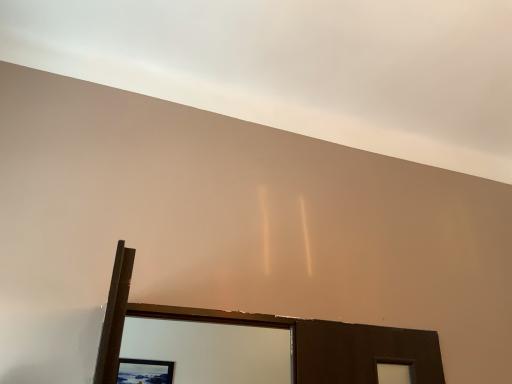
What do you see at coordinates (145, 371) in the screenshot? I see `wooden picture frame at lower center` at bounding box center [145, 371].

Identify the location of wooden picture frame at lower center. The height and width of the screenshot is (384, 512). 145,371.

I want to click on white matte ceiling at upper center, so click(298, 66).

From the picture: What is the approximate height of white matte ceiling at upper center?

white matte ceiling at upper center is 3.42 inches tall.

The image size is (512, 384). What do you see at coordinates (298, 66) in the screenshot?
I see `white matte ceiling at upper center` at bounding box center [298, 66].

You are a GUI agent. You are given a task and a screenshot of the screen. Output one action in this format:
    pyautogui.click(x=<x>, y=<y>)
    Task: Click on the wooden picture frame at lower center
    The width and height of the screenshot is (512, 384).
    Given the screenshot: What is the action you would take?
    pyautogui.click(x=145, y=371)

Which is more to the right, wooden picture frame at lower center or white matte ceiling at upper center?

white matte ceiling at upper center is more to the right.

Which object is further away from the camera, wooden picture frame at lower center or white matte ceiling at upper center?

wooden picture frame at lower center is further away from the camera.

Which point is more distant from viewer, (x=145, y=361) or (x=113, y=29)?

Positioned behind is point (x=145, y=361).

From the image's perspective, would you say wooden picture frame at lower center is shown under white matte ceiling at upper center?

Yes.

From a real-world perspective, who is located lower, wooden picture frame at lower center or white matte ceiling at upper center?

From a 3D spatial view, wooden picture frame at lower center is below.

Does wooden picture frame at lower center have a lesser width compared to white matte ceiling at upper center?

Yes, wooden picture frame at lower center is thinner than white matte ceiling at upper center.

Considering the sizes of objects wooden picture frame at lower center and white matte ceiling at upper center in the image provided, who is taller, wooden picture frame at lower center or white matte ceiling at upper center?

wooden picture frame at lower center is taller.

Based on the photo, considering the relative sizes of wooden picture frame at lower center and white matte ceiling at upper center in the image provided, is wooden picture frame at lower center bigger than white matte ceiling at upper center?

Actually, wooden picture frame at lower center might be smaller than white matte ceiling at upper center.

Is white matte ceiling at upper center surrounded by wooden picture frame at lower center?

No, white matte ceiling at upper center is not inside wooden picture frame at lower center.

Would you consider wooden picture frame at lower center to be distant from white matte ceiling at upper center?

Indeed, wooden picture frame at lower center is not near white matte ceiling at upper center.

Does wooden picture frame at lower center turn towards white matte ceiling at upper center?

Yes, wooden picture frame at lower center is aimed at white matte ceiling at upper center.

The height and width of the screenshot is (384, 512). Identify the location of cloud that is above the wooden picture frame at lower center (from the image's perspective). (298, 66).

Based on their positions, is white matte ceiling at upper center located to the left or right of wooden picture frame at lower center?

Clearly, white matte ceiling at upper center is on the right of wooden picture frame at lower center in the image.

Is white matte ceiling at upper center behind wooden picture frame at lower center?

No.

Considering the positions of points (49, 61) and (157, 366), is point (49, 61) closer to camera compared to point (157, 366)?

Yes, point (49, 61) is in front of point (157, 366).

From the image's perspective, is white matte ceiling at upper center below wooden picture frame at lower center?

No, from the image's perspective, white matte ceiling at upper center is not below wooden picture frame at lower center.

From a real-world perspective, which object rests below the other?

wooden picture frame at lower center.

Considering the relative sizes of white matte ceiling at upper center and wooden picture frame at lower center in the image provided, is white matte ceiling at upper center thinner than wooden picture frame at lower center?

No.

Who is shorter, white matte ceiling at upper center or wooden picture frame at lower center?

white matte ceiling at upper center.

Looking at this image, in terms of size, does white matte ceiling at upper center appear bigger or smaller than wooden picture frame at lower center?

white matte ceiling at upper center is bigger than wooden picture frame at lower center.

Is white matte ceiling at upper center spatially inside wooden picture frame at lower center, or outside of it?

white matte ceiling at upper center exists outside the volume of wooden picture frame at lower center.

Are white matte ceiling at upper center and wooden picture frame at lower center located far from each other?

That's right, there is a large distance between white matte ceiling at upper center and wooden picture frame at lower center.

Is white matte ceiling at upper center oriented away from wooden picture frame at lower center?

No, white matte ceiling at upper center is not facing away from wooden picture frame at lower center.

At what (x,y) coordinates should I click in order to perform the action: click on picture frame located behind the white matte ceiling at upper center. Please return your answer as a coordinate pair (x, y). The width and height of the screenshot is (512, 384). Looking at the image, I should click on (145, 371).

Where is `cloud in front of the wooden picture frame at lower center`? The width and height of the screenshot is (512, 384). cloud in front of the wooden picture frame at lower center is located at coordinates (298, 66).

In order to click on cloud above the wooden picture frame at lower center (from a real-world perspective) in this screenshot , I will do `click(298, 66)`.